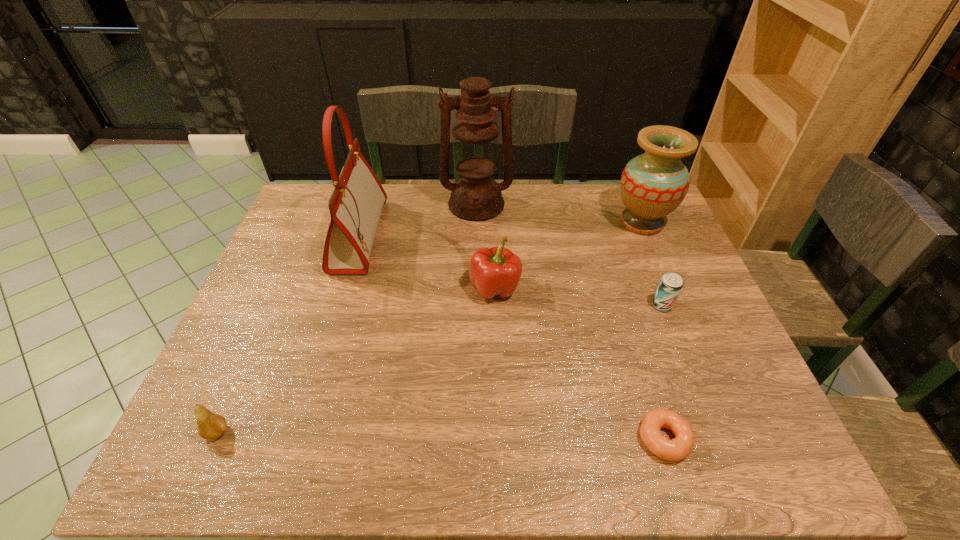
Locate an element on the screen. This screenshot has width=960, height=540. empty location between the fourth tallest object and the oil lamp is located at coordinates (486, 246).

Where is `free spot between the handbag and the leftmost object`? free spot between the handbag and the leftmost object is located at coordinates (288, 334).

The width and height of the screenshot is (960, 540). In order to click on vacant region between the third tallest object and the doughnut in this screenshot , I will do `click(653, 331)`.

What are the coordinates of `unoccupied area between the pepper and the pear` in the screenshot? It's located at (x=356, y=360).

Image resolution: width=960 pixels, height=540 pixels. What are the coordinates of `vacant area between the handbag and the shortest object` in the screenshot? It's located at (512, 337).

The image size is (960, 540). Identify the location of free space that is in between the oil lamp and the leftmost object. (347, 318).

This screenshot has height=540, width=960. Identify the location of free space between the third tallest object and the doughnut. (653, 331).

Identify which object is located as the second nearest to the handbag. Please provide its 2D coordinates. Your answer should be formatted as a tuple, i.e. [(x, y)], where the tuple contains the x and y coordinates of a point satisfying the conditions above.

[(493, 272)]

Choose which object is the second nearest neighbor to the leftmost object. Please provide its 2D coordinates. Your answer should be formatted as a tuple, i.e. [(x, y)], where the tuple contains the x and y coordinates of a point satisfying the conditions above.

[(493, 272)]